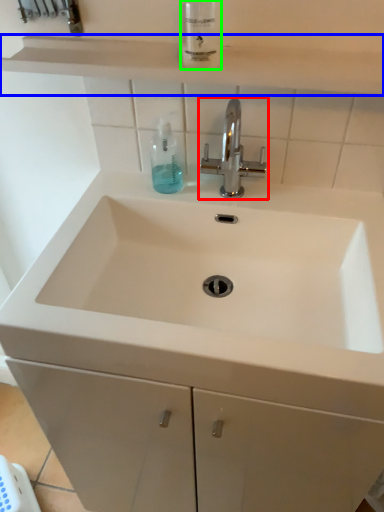
Question: Estimate the real-world distances between objects in this image. Which object is farther from tap (highlighted by a red box), shelve (highlighted by a blue box) or mouthwash (highlighted by a green box)?

Choices:
 (A) shelve
 (B) mouthwash

Answer: (A)